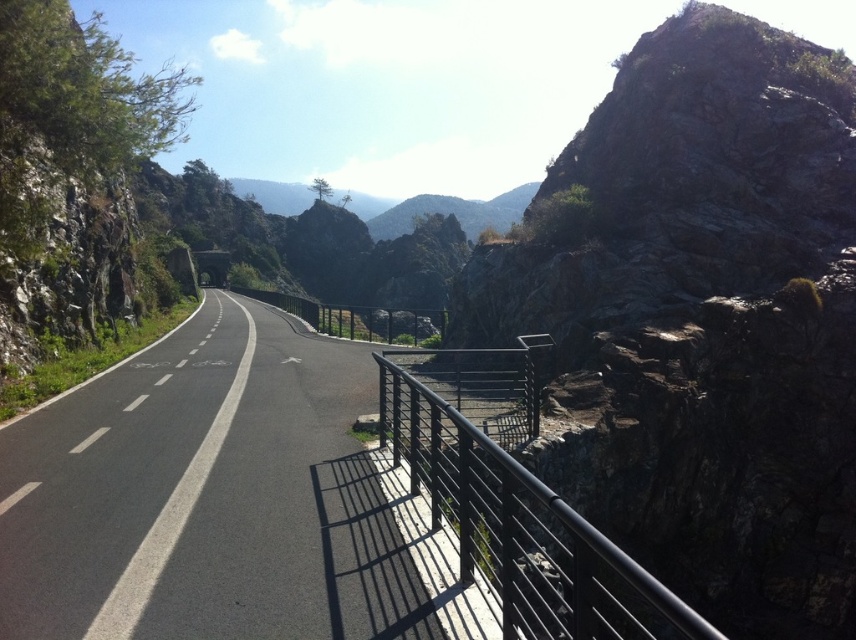
You are a hiker planning to take a photo of the rugged stone mountain at upper right and the black asphalt highway at center. Which object should you focus on first if you want to capture both in a single frame without moving your camera?

You should focus on the rugged stone mountain at upper right first because it is positioned on the right side of the black asphalt highway at center, so keeping it in the frame while adjusting the camera angle to include the highway would be easier.

You are a photographer planning to capture the rugged stone mountain at upper right and the black metal railing at right in a single photo. Based on the scene, which object will appear taller in the photo?

The rugged stone mountain at upper right will appear taller in the photo because it has a greater height compared to the black metal railing at right.

You are standing at the edge of the road and want to cross the black asphalt highway at center. The road is 3.79 meters wide. Can you safely cross it within 10 seconds if a car is approaching at 20 km per hour?

The black asphalt highway at center is 3.79 meters wide. A car moving at 20 km per hour travels approximately 5.56 meters per second. To cross the 3.79 meters, it would take about 0.68 seconds. Since the car is approaching, you should wait until it passes before attempting to cross, as the time needed to cross is minimal but depends on the car distance. Safety first!